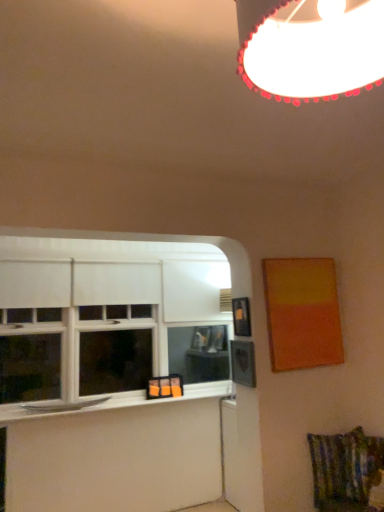
Question: Does white glossy window sill at lower left have a larger size compared to textured multicolored fabric swivel chair at lower right?

Choices:
 (A) yes
 (B) no

Answer: (B)

Question: Is white glossy window sill at lower left at the left side of textured multicolored fabric swivel chair at lower right?

Choices:
 (A) no
 (B) yes

Answer: (B)

Question: Can you confirm if white glossy window sill at lower left is shorter than textured multicolored fabric swivel chair at lower right?

Choices:
 (A) no
 (B) yes

Answer: (B)

Question: From the image's perspective, is white glossy window sill at lower left over textured multicolored fabric swivel chair at lower right?

Choices:
 (A) no
 (B) yes

Answer: (B)

Question: Is white glossy window sill at lower left placed right next to textured multicolored fabric swivel chair at lower right?

Choices:
 (A) no
 (B) yes

Answer: (A)

Question: Considering the positions of point (264, 13) and point (342, 466), is point (264, 13) closer or farther from the camera than point (342, 466)?

Choices:
 (A) farther
 (B) closer

Answer: (B)

Question: From a real-world perspective, is white glossy lampshade at upper center positioned above or below textured multicolored fabric swivel chair at lower right?

Choices:
 (A) above
 (B) below

Answer: (A)

Question: Do you think white glossy lampshade at upper center is within textured multicolored fabric swivel chair at lower right, or outside of it?

Choices:
 (A) inside
 (B) outside

Answer: (B)

Question: From the image's perspective, relative to textured multicolored fabric swivel chair at lower right, is white glossy lampshade at upper center above or below?

Choices:
 (A) below
 (B) above

Answer: (B)

Question: Choose the correct answer: Is matte orange painting at right, the first picture frame in the right-to-left sequence, inside textured multicolored fabric swivel chair at lower right or outside it?

Choices:
 (A) outside
 (B) inside

Answer: (A)

Question: Considering the positions of matte orange painting at right, the first picture frame in the right-to-left sequence, and textured multicolored fabric swivel chair at lower right in the image, is matte orange painting at right, the first picture frame in the right-to-left sequence, bigger or smaller than textured multicolored fabric swivel chair at lower right?

Choices:
 (A) small
 (B) big

Answer: (B)

Question: In the image, is matte orange painting at right, the first picture frame in the right-to-left sequence, positioned in front of or behind textured multicolored fabric swivel chair at lower right?

Choices:
 (A) behind
 (B) front

Answer: (A)

Question: Would you say matte orange painting at right, the first picture frame in the right-to-left sequence, is to the left or to the right of textured multicolored fabric swivel chair at lower right in the picture?

Choices:
 (A) left
 (B) right

Answer: (A)

Question: From the image's perspective, is white glossy window sill at lower left located above or below white glossy lampshade at upper center?

Choices:
 (A) above
 (B) below

Answer: (B)

Question: Based on their positions, is white glossy window sill at lower left located to the left or right of white glossy lampshade at upper center?

Choices:
 (A) right
 (B) left

Answer: (B)